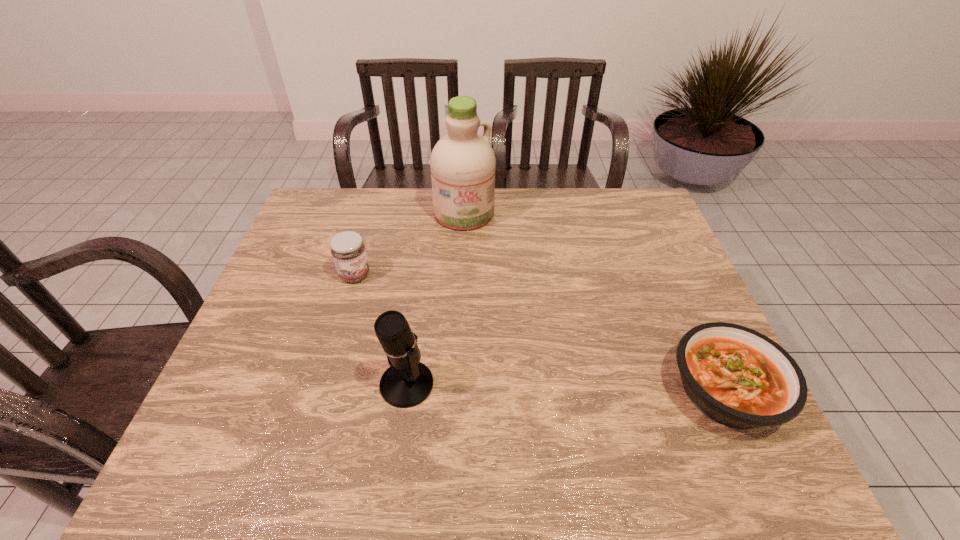
Find the location of a particular element. The image size is (960, 540). vacant region between the rightmost object and the leftmost object is located at coordinates (540, 333).

Locate an element on the screen. This screenshot has height=540, width=960. vacant space that is in between the farthest object and the microphone is located at coordinates (436, 299).

In order to click on free space between the cleansing agent and the second shortest object in this screenshot , I will do `click(410, 244)`.

Locate an element on the screen. The height and width of the screenshot is (540, 960). vacant space in between the microphone and the cleansing agent is located at coordinates (436, 299).

Choose which object is the nearest neighbor to the second tallest object. Please provide its 2D coordinates. Your answer should be formatted as a tuple, i.e. [(x, y)], where the tuple contains the x and y coordinates of a point satisfying the conditions above.

[(348, 251)]

You are a GUI agent. You are given a task and a screenshot of the screen. Output one action in this format:
    pyautogui.click(x=<x>, y=<y>)
    Task: Click on the object that stands as the second closest to the stew
    The width and height of the screenshot is (960, 540).
    Given the screenshot: What is the action you would take?
    pyautogui.click(x=462, y=163)

Find the location of a particular element. Image resolution: width=960 pixels, height=540 pixels. vacant space that satisfies the following two spatial constraints: 1. on the front side of the leftmost object; 2. on the left side of the microphone is located at coordinates (323, 384).